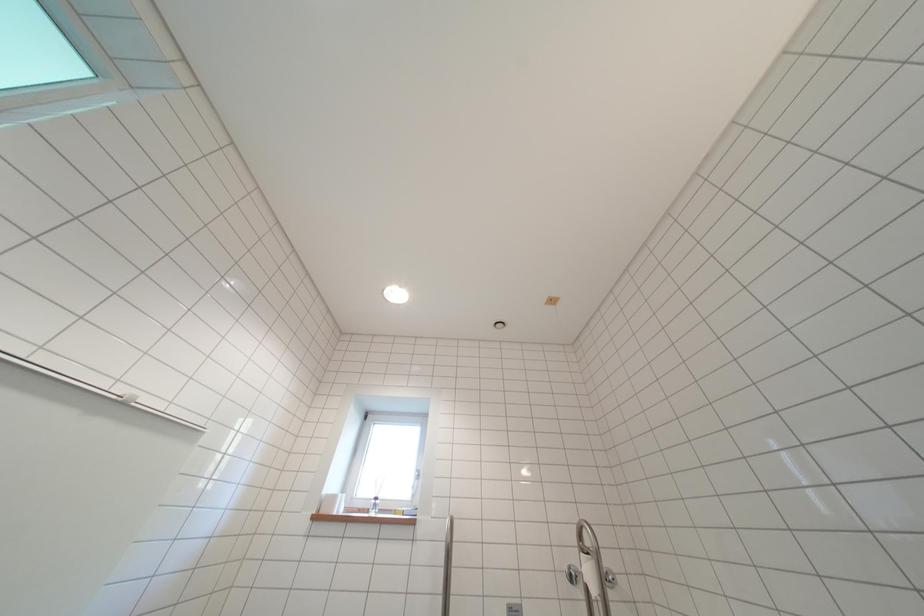
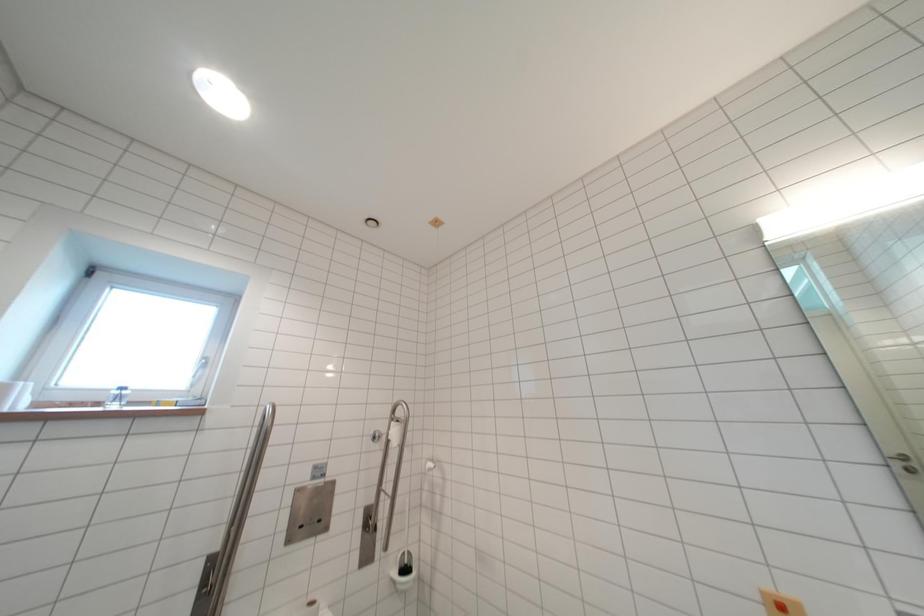
Question: The camera is either moving clockwise (left) or counter-clockwise (right) around the object. The first image is from the beginning of the video and the second image is from the end. Is the camera moving left or right when shooting the video?

Choices:
 (A) Left
 (B) Right

Answer: (A)